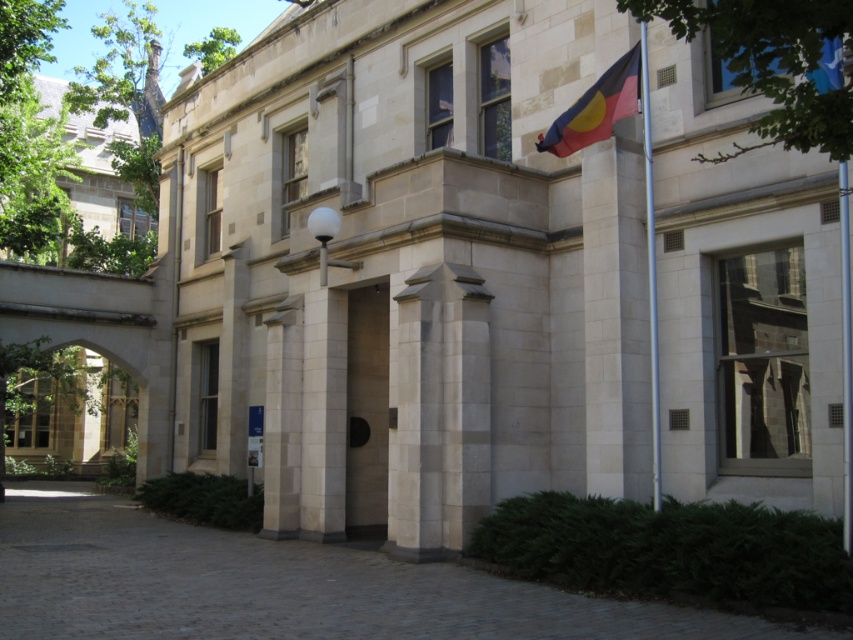
Based on the scene description, can you determine the relative positions of the white stone column at center and the smooth stone door at center? Specifically, which one is positioned to the right?

The white stone column at center is to the right of the smooth stone door at center.

You are an architect designing a new building inspired by classical architecture. You need to ensure that the door and flagpole proportions match the original structure. Given that the smooth stone door at center is thinner than the textured fabric flag at upper right, which object should you make wider in your design to maintain the original proportions?

To maintain the original proportions, the smooth stone door at center should be made wider because it is thinner than the textured fabric flag at upper right in the original structure.